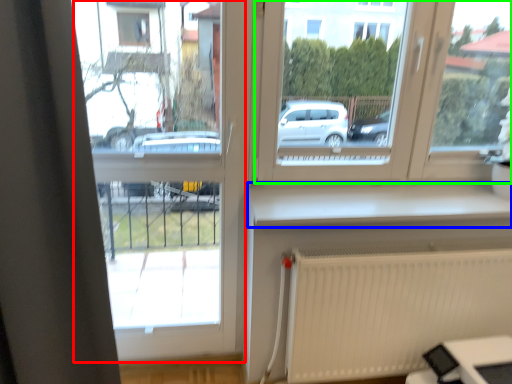
Question: Which object is positioned closest to window frame (highlighted by a red box)? Select from window sill (highlighted by a blue box) and window (highlighted by a green box).

Choices:
 (A) window sill
 (B) window

Answer: (B)